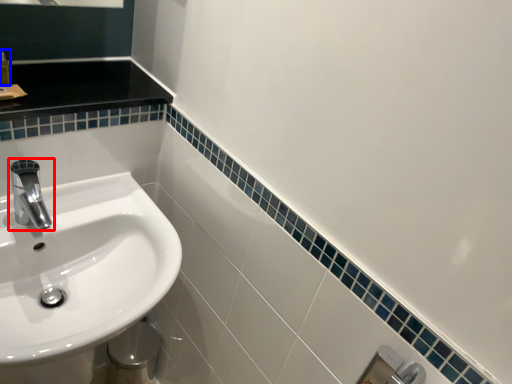
Question: Among these objects, which one is farthest to the camera, tap (highlighted by a red box) or toiletry (highlighted by a blue box)?

Choices:
 (A) tap
 (B) toiletry

Answer: (B)